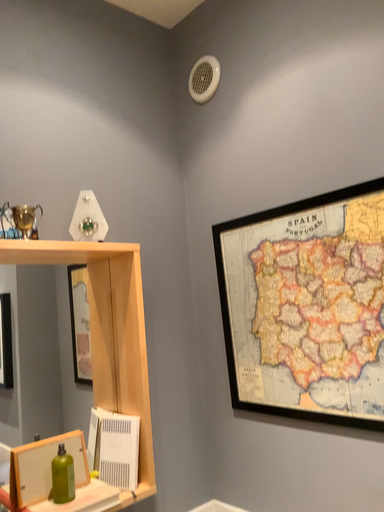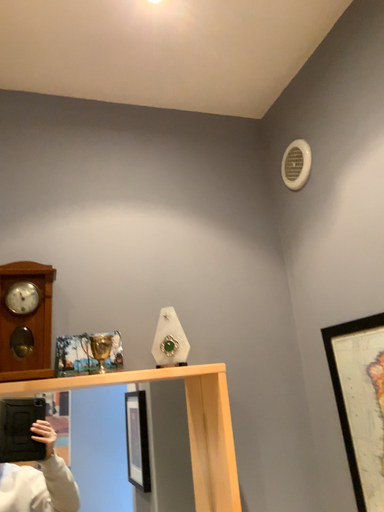
Question: How did the camera likely rotate when shooting the video?

Choices:
 (A) rotated upward
 (B) rotated downward

Answer: (A)